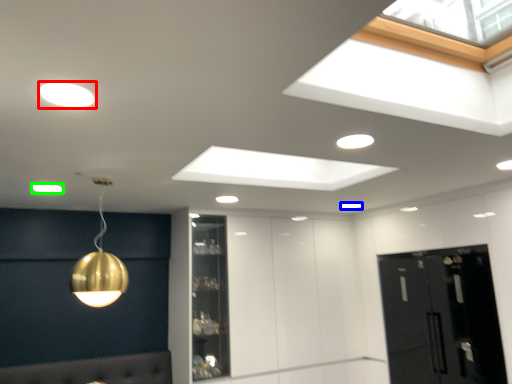
Question: Considering the real-world distances, which object is farthest from lamp (highlighted by a red box)? lamp (highlighted by a blue box) or lamp (highlighted by a green box)?

Choices:
 (A) lamp
 (B) lamp

Answer: (A)